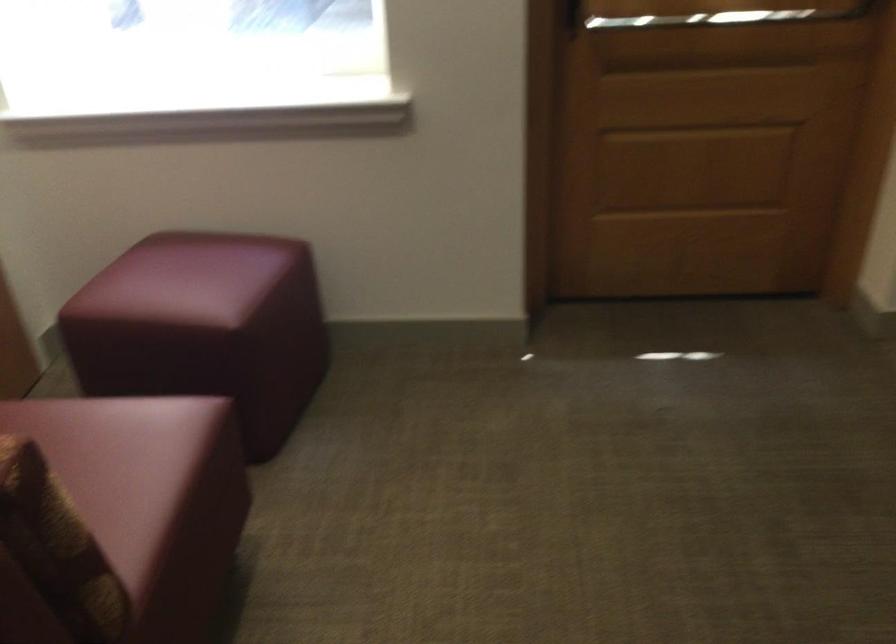
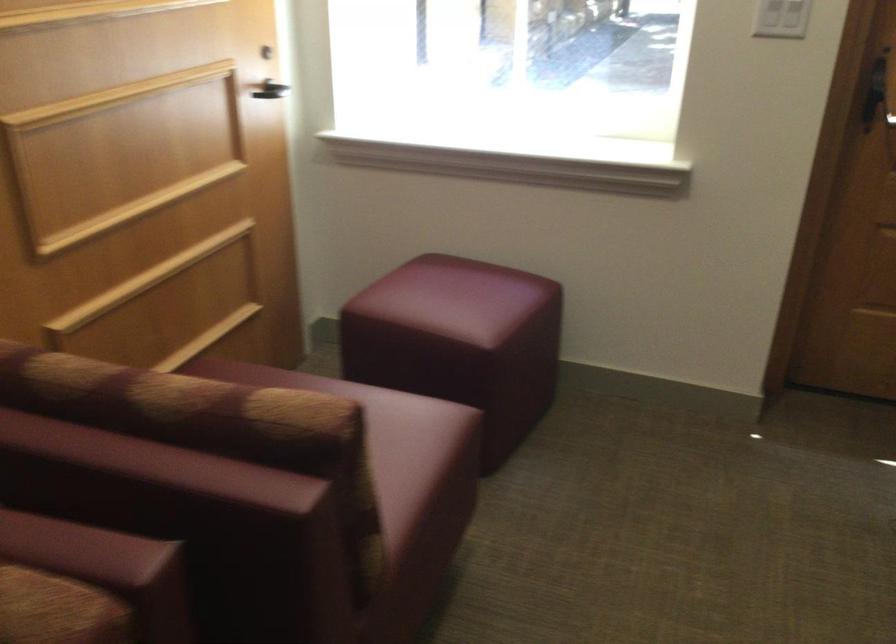
In the second image, find the point that corresponds to [140,451] in the first image.

(392, 444)